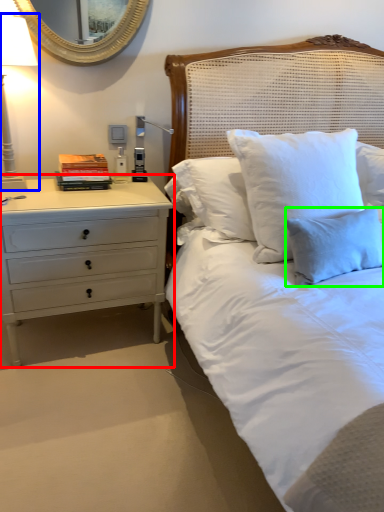
Question: Considering the real-world distances, which object is farthest from chest of drawers (highlighted by a red box)? bedside lamp (highlighted by a blue box) or pillow (highlighted by a green box)?

Choices:
 (A) bedside lamp
 (B) pillow

Answer: (B)